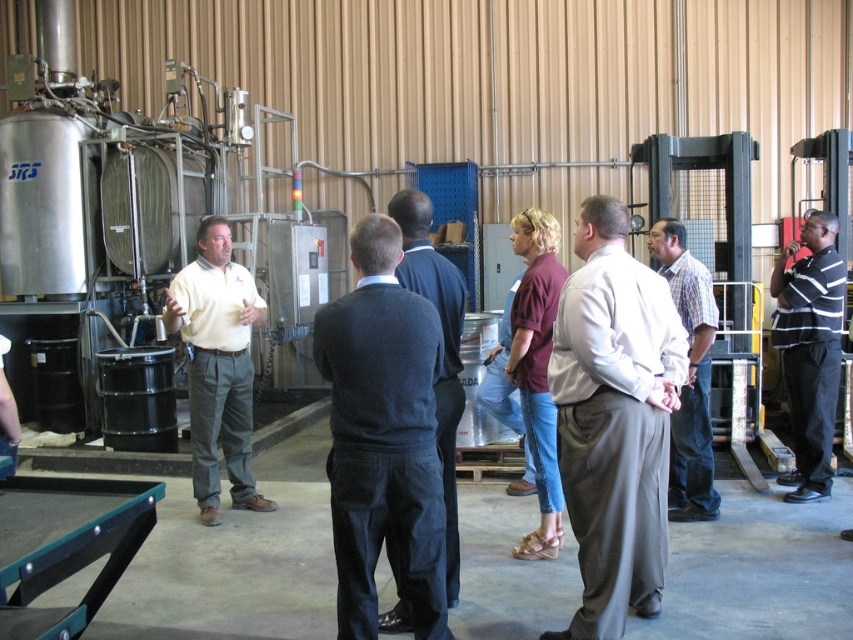
Does dark blue sweater at center lie in front of matte yellow shirt at center?

Yes.

Consider the image. How far apart are dark blue sweater at center and matte yellow shirt at center?

7.11 feet

Between point (344, 417) and point (233, 321), which one is positioned in front?

Point (344, 417)

Find the location of a particular element. This screenshot has height=640, width=853. dark blue sweater at center is located at coordinates (383, 438).

Who is more distant from viewer, (x=370, y=317) or (x=689, y=358)?

Positioned behind is point (x=689, y=358).

Between dark blue sweater at center and plaid cotton shirt at center, which one is positioned lower?

dark blue sweater at center is lower down.

Who is more forward, (375, 376) or (717, 500)?

Point (375, 376) is more forward.

Locate an element on the screen. This screenshot has height=640, width=853. dark blue sweater at center is located at coordinates (383, 438).

Is point (604, 545) closer to camera compared to point (442, 449)?

Yes, it is in front of point (442, 449).

Is light gray trousers at center thinner than dark gray sweater at center?

In fact, light gray trousers at center might be wider than dark gray sweater at center.

Is point (634, 364) positioned in front of point (421, 291)?

Yes.

Find the location of a particular element. The height and width of the screenshot is (640, 853). light gray trousers at center is located at coordinates (614, 419).